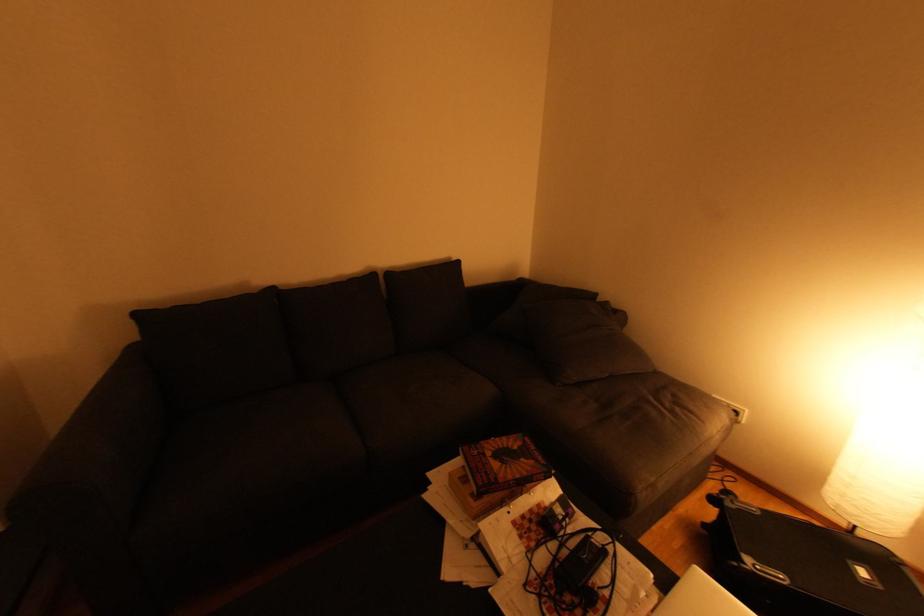
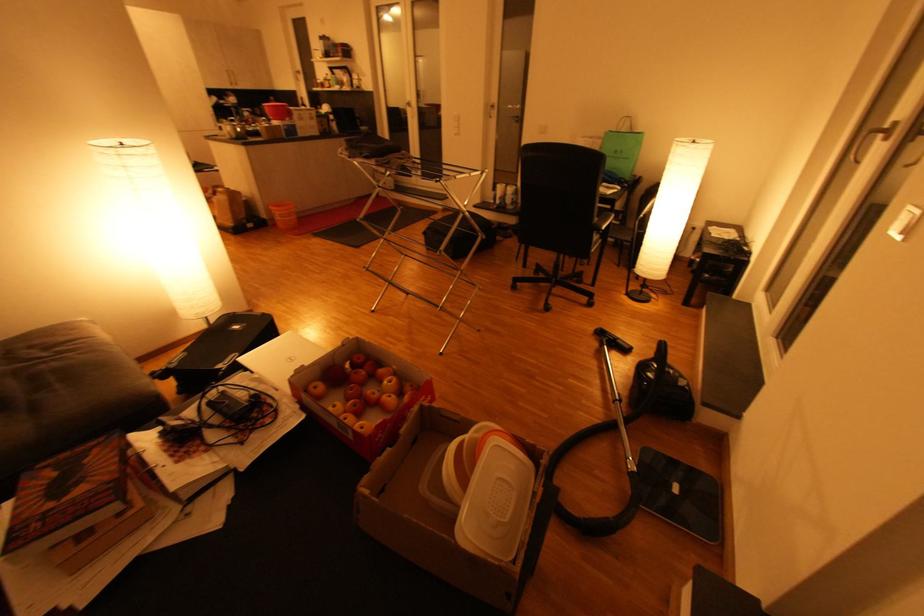
Based on the continuous images, in which direction is the camera rotating?

The rotation direction of the camera is right-down.